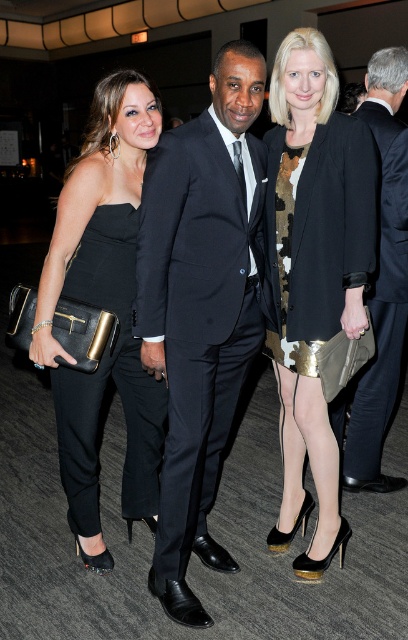
You are attending a formal event and notice two attendees dressed in black. The first is wearing a black satin dress at left, and the second is in a satin black suit at center. From your perspective, which of these two outfits is positioned lower in the image?

The black satin dress at left is located below the satin black suit at center, so the black satin dress at left is positioned lower in the image.

You are standing in the same room as the three people in the image. You want to walk towards the point closer to you between the two points labeled point (261, 154) and point (124, 385). Which point should you walk towards?

You should walk towards point (261, 154) because it is closer to the viewer than point (124, 385) according to the description.

Looking at this image, you are a photographer at the event and need to adjust the camera focus. Which of the two, the black satin dress at left or the satin black suit at center, should you focus on first if you want to capture the taller subject?

The satin black suit at center is taller than the black satin dress at left, so you should focus on the satin black suit at center first.